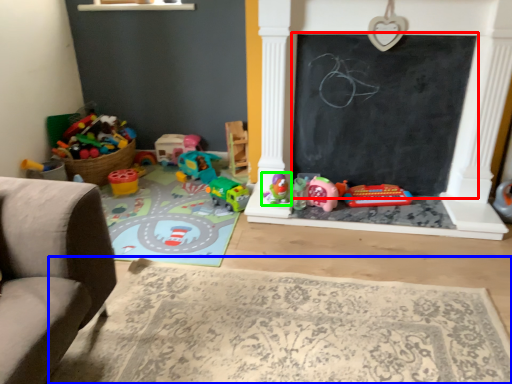
Question: Based on their relative distances, which object is nearer to bulletin board (highlighted by a red box)? Choose from mat (highlighted by a blue box) and toy (highlighted by a green box).

Choices:
 (A) mat
 (B) toy

Answer: (B)